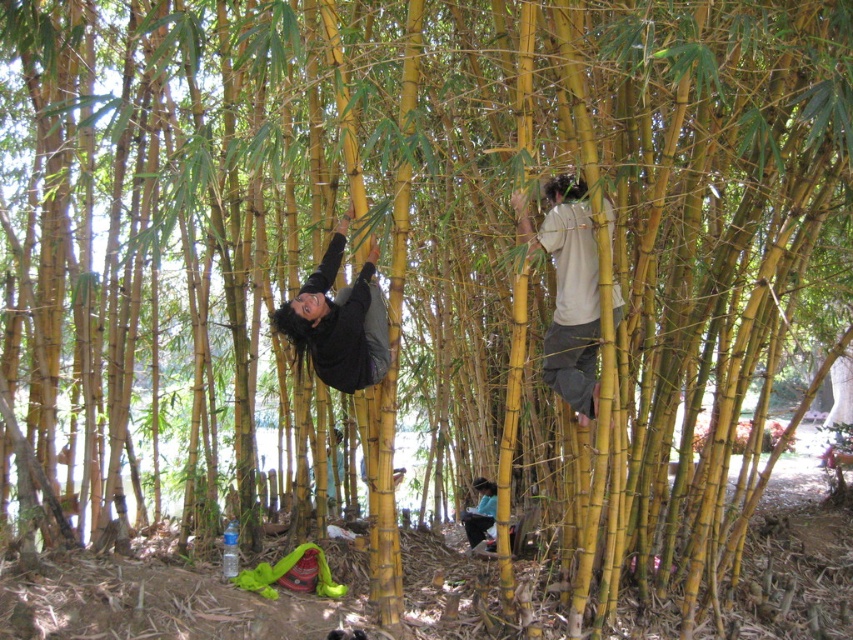
Consider the image. You are a photographer positioned at the base of the bamboo grove. You want to capture a photo that includes both the white matte shirt at upper right and the black matte shirt at center. Based on their positions, which shirt should you adjust your camera to focus on first to ensure both are in frame?

Since the white matte shirt at upper right is positioned to the right of the black matte shirt at center, you should focus on the white matte shirt at upper right first to ensure both are within the camera frame.

You are a photographer trying to capture a candid shot of the climbers in the bamboo grove. You want to focus on the person in the white matte shirt at upper right and the dark gray fabric at lower center. Which of these two objects is positioned closer to your camera lens?

The white matte shirt at upper right is closer to the viewer than the dark gray fabric at lower center, so the white matte shirt at upper right will be in focus first as it is nearer to the camera lens.